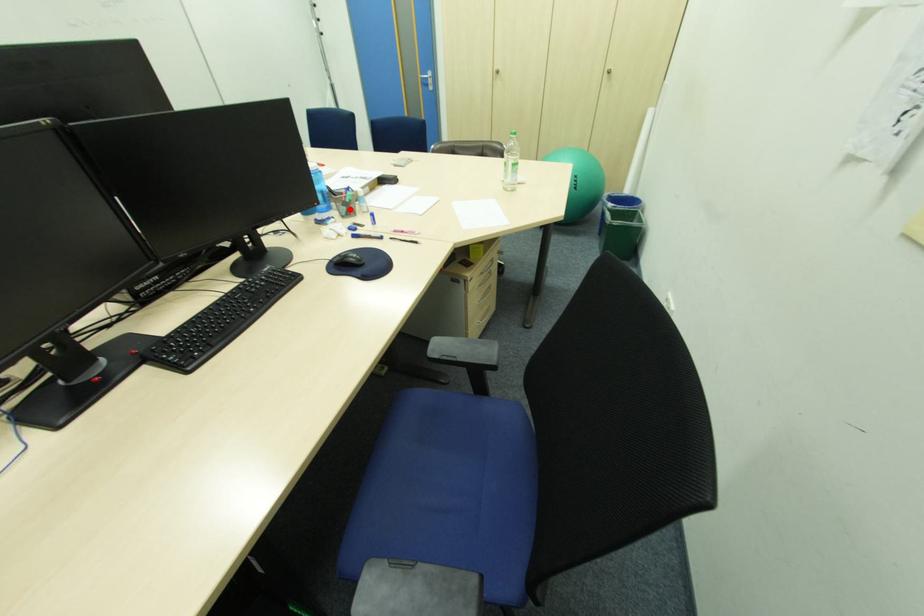
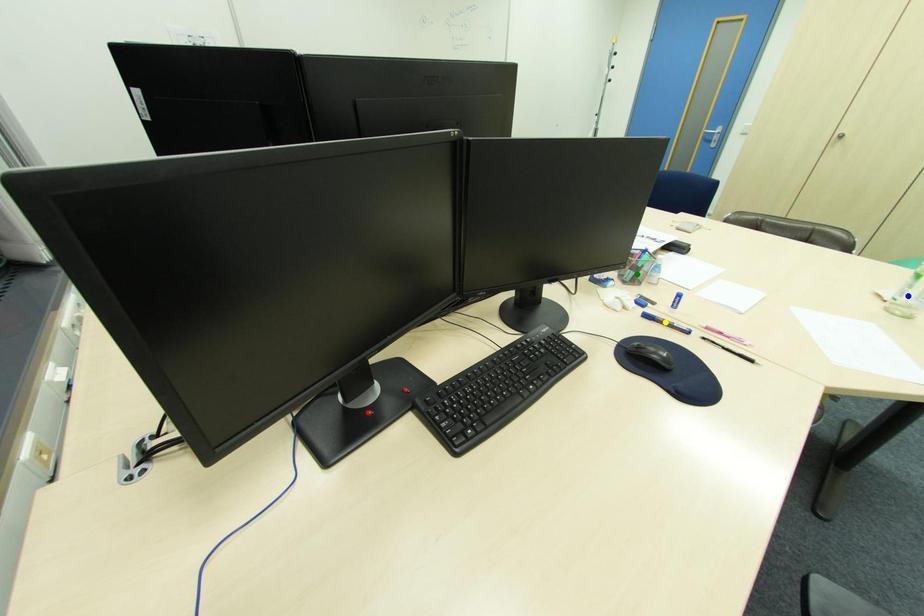
Question: I am providing you with two images of the same scene from different viewpoints. A red point is marked on the first image. You are given multiple points on the second image. Which point in image 2 is actually the same real-world point as the red point in image 1?

Choices:
 (A) blue point
 (B) green point
 (C) yellow point

Answer: (B)